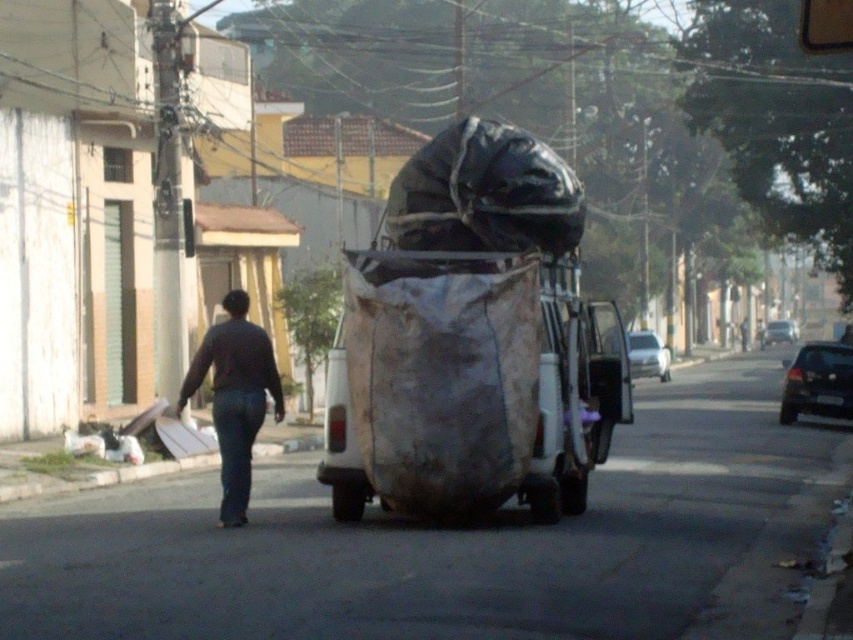
The height and width of the screenshot is (640, 853). I want to click on shiny black car at right, so click(817, 381).

Which of these two, shiny black car at right or gray concrete curb at lower left, stands shorter?

Standing shorter between the two is gray concrete curb at lower left.

Is point (801, 406) positioned behind point (161, 468)?

Yes, it is.

Locate an element on the screen. The width and height of the screenshot is (853, 640). shiny black car at right is located at coordinates (817, 381).

Can you confirm if dark blue jeans at center is positioned to the right of white glossy car at center?

No, dark blue jeans at center is not to the right of white glossy car at center.

Does dark blue jeans at center have a greater width compared to white glossy car at center?

Incorrect, dark blue jeans at center's width does not surpass white glossy car at center's.

Identify the location of dark blue jeans at center. (235, 396).

Locate an element on the screen. This screenshot has height=640, width=853. dark blue jeans at center is located at coordinates (235, 396).

Does shiny black car at right come in front of white glossy car at center?

No, shiny black car at right is behind white glossy car at center.

In the scene shown: Is shiny black car at right wider than white glossy car at center?

No.

This screenshot has width=853, height=640. I want to click on shiny black car at right, so click(817, 381).